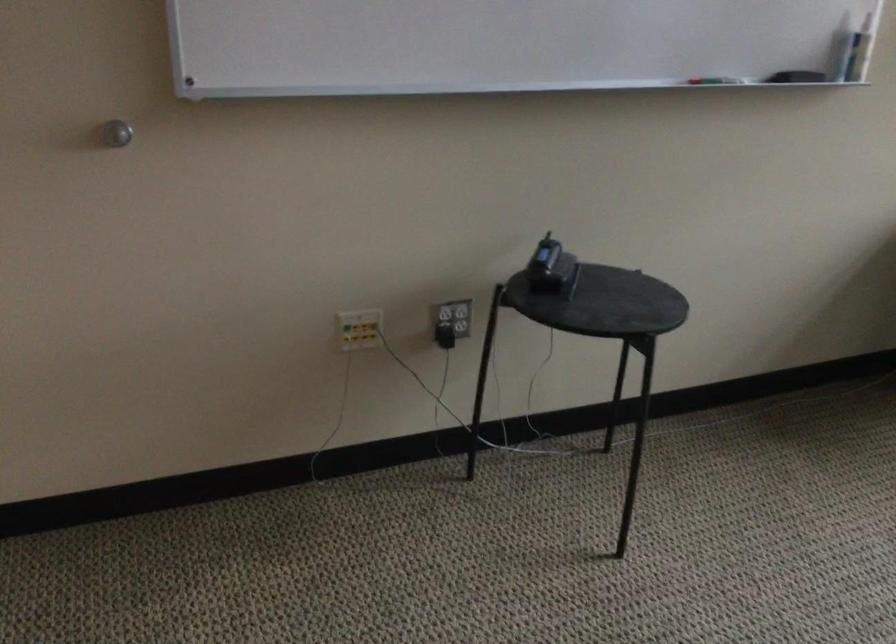
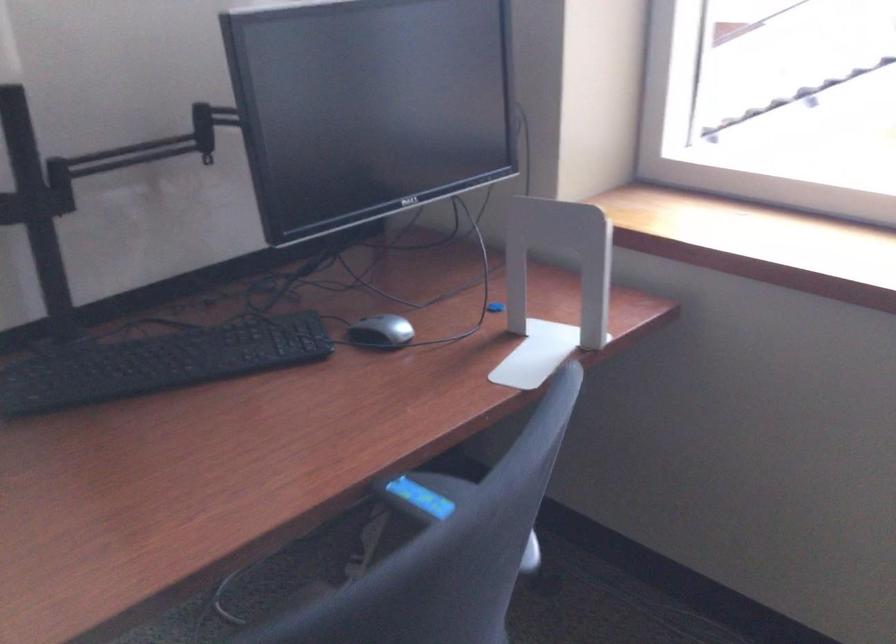
Which direction would the cameraman need to move to produce the second image?

The cameraman moved toward right, backward.